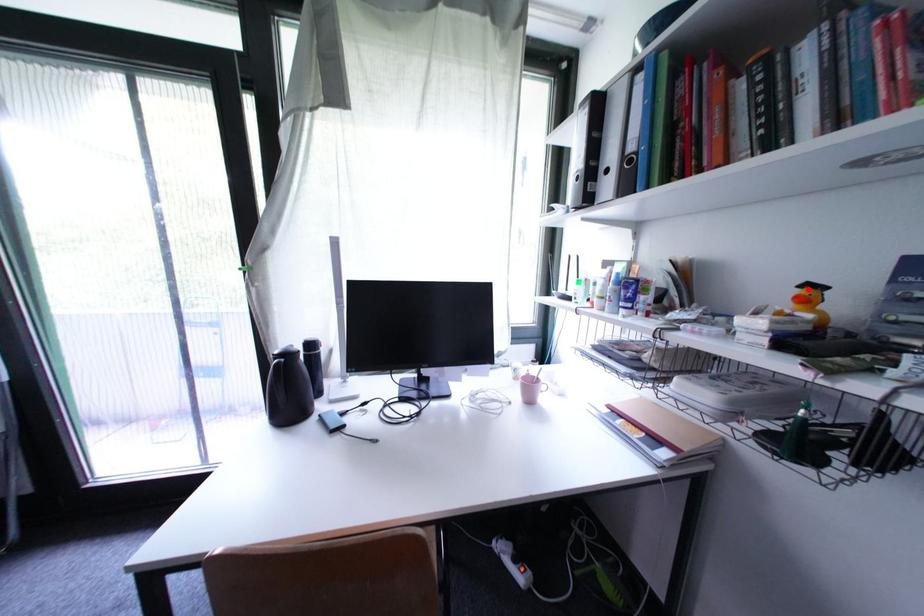
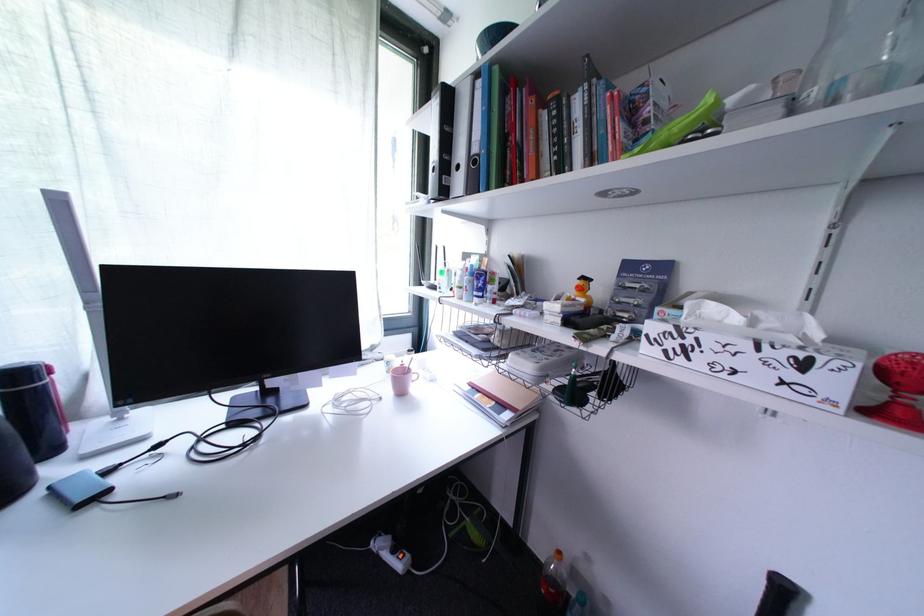
The point at the highlighted location is marked in the first image. Where is the corresponding point in the second image?

(588, 282)